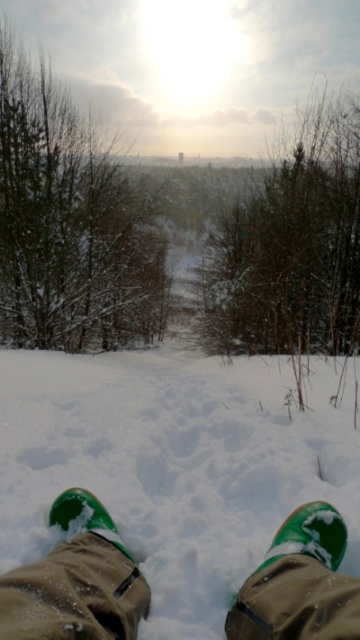
You are standing in the snow and see two points marked in the image. The first point is at coordinates point (289,525) and the second is at point (84,513). Which point is closer to you?

Point (289,525) is in front of point (84,513), so it is closer to you.

You are trying to identify the footwear in the snow. Which one is bigger between the green suede shoe at lower center and the green suede boot at lower center?

The green suede shoe at lower center is larger in size compared to the green suede boot at lower center.

You are standing in the snow and see your green suede boots at lower center and green suede boot at lower center. Which one is on the right side?

The green suede boots at lower center is positioned on the right side of green suede boot at lower center.